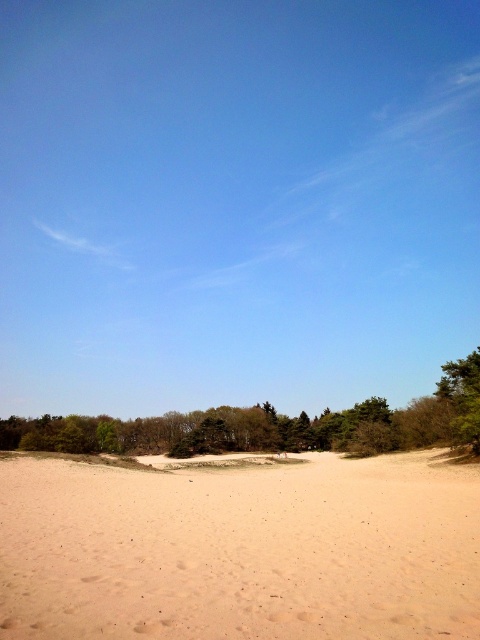
Question: Does light brown sandy at center come in front of green leafy tree at lower left?

Choices:
 (A) no
 (B) yes

Answer: (B)

Question: Which point is closer to the camera?

Choices:
 (A) (129, 420)
 (B) (117, 497)

Answer: (B)

Question: Can you confirm if light brown sandy at center is smaller than green leafy tree at lower left?

Choices:
 (A) no
 (B) yes

Answer: (B)

Question: Which point appears closest to the camera in this image?

Choices:
 (A) (312, 445)
 (B) (69, 556)

Answer: (B)

Question: Can you confirm if light brown sandy at center is thinner than green leafy tree at lower left?

Choices:
 (A) yes
 (B) no

Answer: (A)